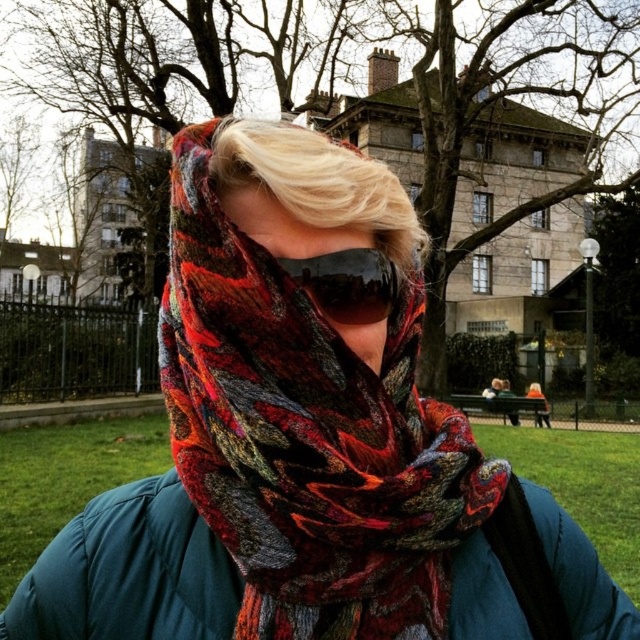
You are organizing a costume party and need to decide whether to place the glossy plastic goggles at center and the orange knit hat at center on a small shelf. Based on their sizes, which item should you place first to ensure both fit on the shelf?

The glossy plastic goggles at center occupies less space than orange knit hat at center, so you should place the orange knit hat at center first to ensure both items fit on the small shelf.

You are a photographer trying to capture a clear shot of the orange knit hat at center. However, the glossy plastic goggles at center are blocking your view. Can you adjust your angle to see the hat without the goggles obstructing it?

The glossy plastic goggles at center is in front of orange knit hat at center, so adjusting your angle to look around the goggles might allow you to see the hat without obstruction.